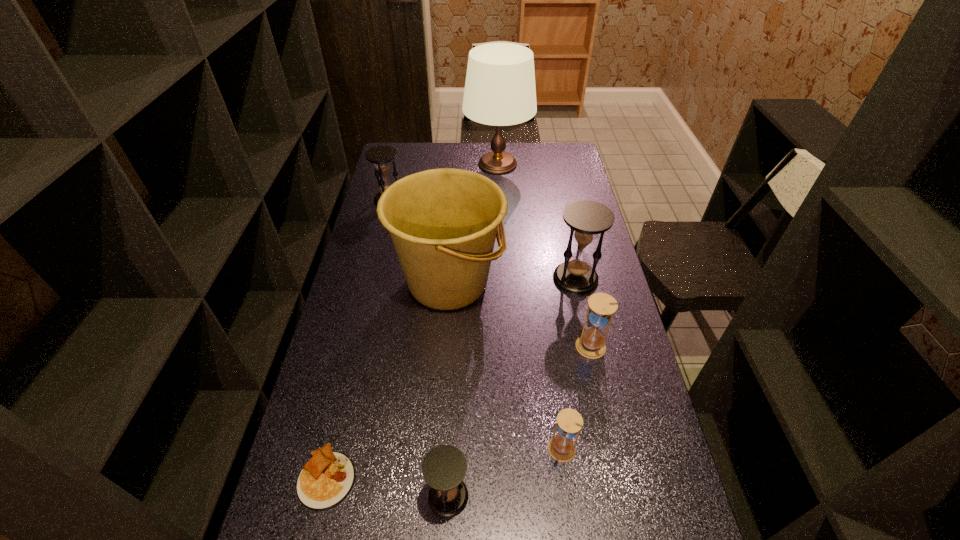
At what (x,y) coordinates should I click in order to perform the action: click on the fourth closest hourglass to the omelet. Please return your answer as a coordinate pair (x, y). Looking at the image, I should click on (587, 219).

Identify which hourglass is the second closest to the second tallest object. Please provide its 2D coordinates. Your answer should be formatted as a tuple, i.e. [(x, y)], where the tuple contains the x and y coordinates of a point satisfying the conditions above.

[(601, 307)]

Locate an element on the screen. This screenshot has height=540, width=960. the closest black hourglass to the third hourglass from left to right is located at coordinates (444, 468).

Locate an element on the screen. black hourglass that is the nearest to the second smallest black hourglass is located at coordinates (587, 219).

Locate an element on the screen. The width and height of the screenshot is (960, 540). vacant space that satisfies the following two spatial constraints: 1. on the front side of the omelet; 2. on the right side of the farthest black hourglass is located at coordinates (320, 477).